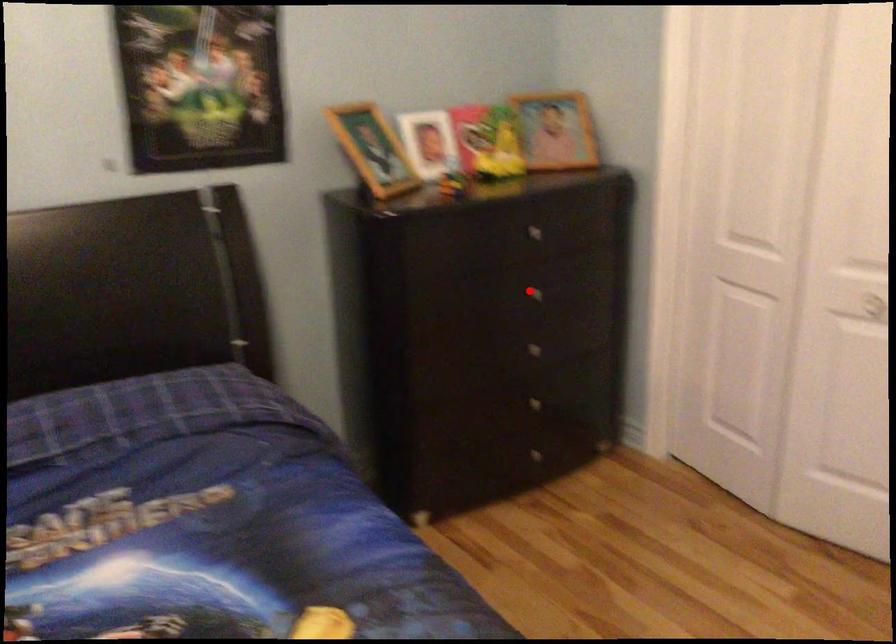
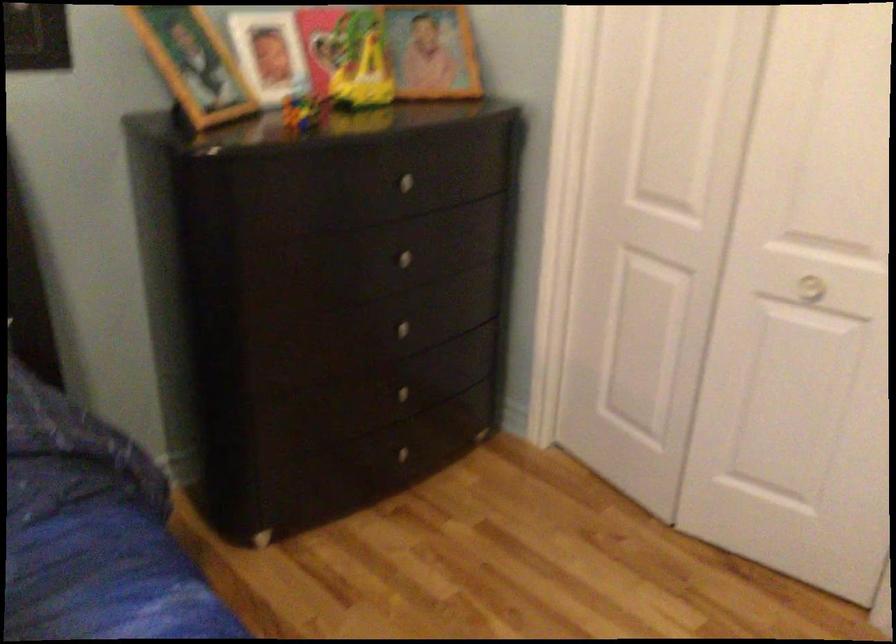
Question: I am providing you with two images of the same scene from different viewpoints. Image1 has a red point marked. In image2, the corresponding 3D location appears at what relative position? Reply with the corresponding letter.

Choices:
 (A) Closer
 (B) Farther

Answer: (A)